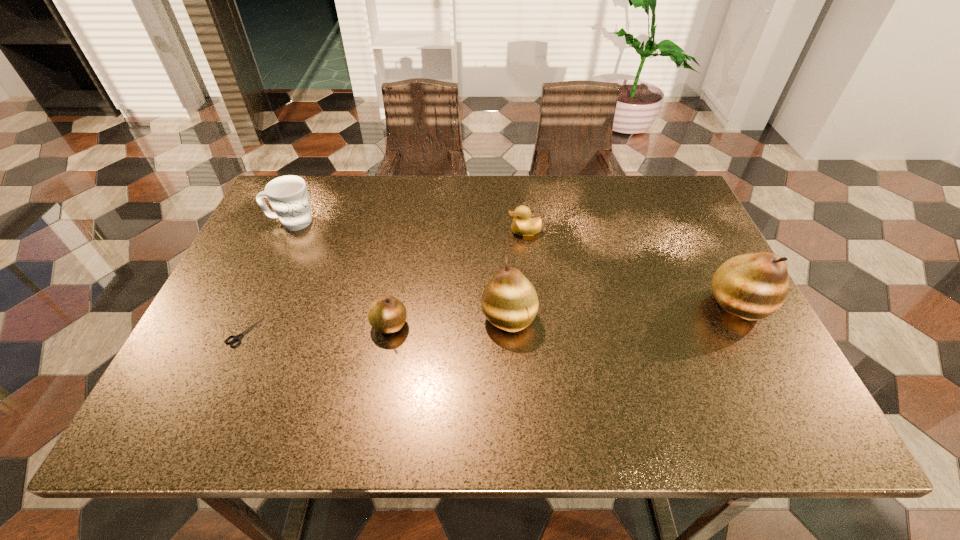
Where is `object that is at the right edge`? object that is at the right edge is located at coordinates (753, 286).

Locate an element on the screen. object positioned at the far left corner is located at coordinates (288, 195).

Locate an element on the screen. free space at the far edge of the desktop is located at coordinates (510, 224).

Where is `vacant position at the near edge of the desktop`? The height and width of the screenshot is (540, 960). vacant position at the near edge of the desktop is located at coordinates (672, 359).

Where is `vacant area at the left edge`? vacant area at the left edge is located at coordinates (285, 300).

This screenshot has height=540, width=960. Find the location of `free location at the right edge`. free location at the right edge is located at coordinates (718, 315).

Where is `vacant area at the near left corner of the desktop`? vacant area at the near left corner of the desktop is located at coordinates (233, 378).

Where is `free space that is in between the mug and the second pear from left to right`? free space that is in between the mug and the second pear from left to right is located at coordinates tap(400, 271).

This screenshot has height=540, width=960. I want to click on free space between the leftmost pear and the shears, so click(317, 328).

Where is `free point between the third object from left to right and the second tallest object`? This screenshot has height=540, width=960. free point between the third object from left to right and the second tallest object is located at coordinates (449, 322).